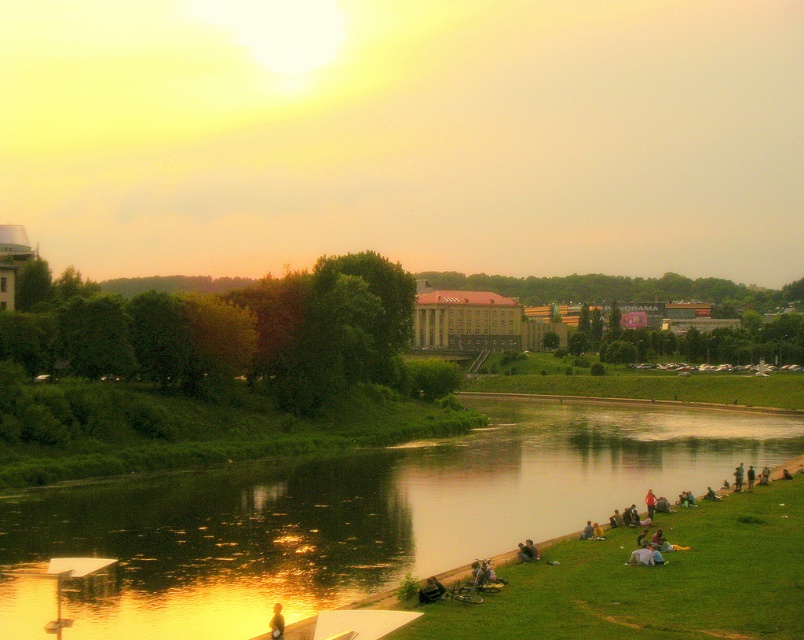
Question: Which of the following is the farthest from the observer?

Choices:
 (A) (572, 580)
 (B) (171, 550)

Answer: (B)

Question: Which object is closer to the camera taking this photo?

Choices:
 (A) smooth white shirt at lower right
 (B) green grass at lower right
 (C) smooth skin person at lower center

Answer: (B)

Question: Which object appears farthest from the camera in this image?

Choices:
 (A) green grass at lower right
 (B) smooth white shirt at lower right
 (C) green reflective water at center
 (D) smooth skin person at lower center

Answer: (B)

Question: Can you confirm if green reflective water at center is positioned to the right of smooth skin person at lower center?

Choices:
 (A) yes
 (B) no

Answer: (A)

Question: Does green reflective water at center appear on the right side of green grass at lower right?

Choices:
 (A) no
 (B) yes

Answer: (A)

Question: Considering the relative positions of green reflective water at center and green grass at lower right in the image provided, where is green reflective water at center located with respect to green grass at lower right?

Choices:
 (A) right
 (B) left

Answer: (B)